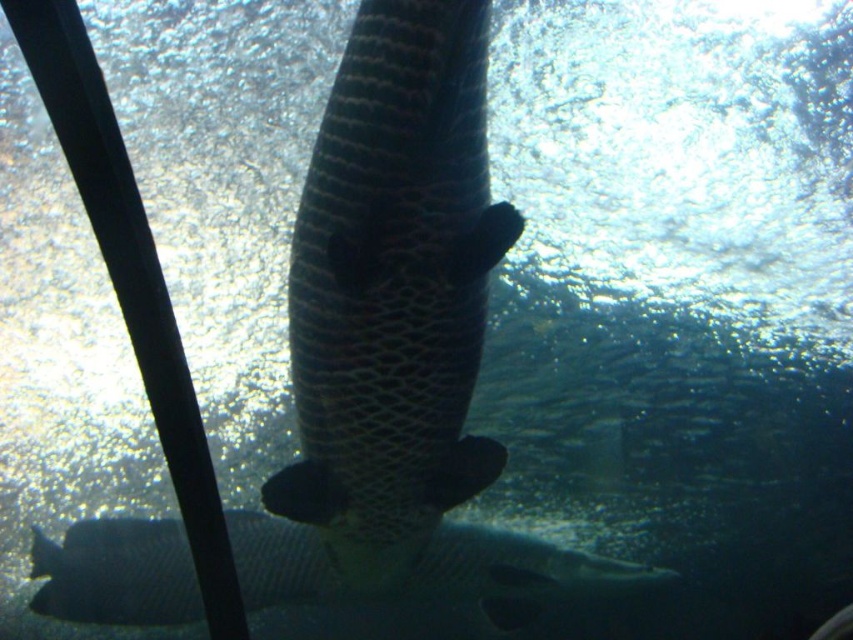
Identify the location of dark textured fish at center. The height and width of the screenshot is (640, 853). (393, 289).

Is dark textured fish at center bigger than dark gray textured fish at lower center?

Actually, dark textured fish at center might be smaller than dark gray textured fish at lower center.

Does point (352, 429) come behind point (540, 596)?

No, (352, 429) is closer to viewer.

At what (x,y) coordinates should I click in order to perform the action: click on dark textured fish at center. Please return your answer as a coordinate pair (x, y). This screenshot has height=640, width=853. Looking at the image, I should click on (393, 289).